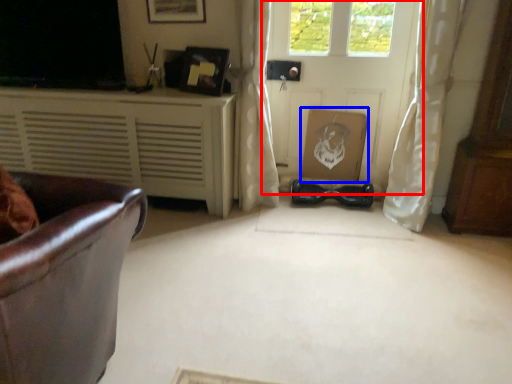
Question: Among these objects, which one is farthest to the camera, door (highlighted by a red box) or cardboard box (highlighted by a blue box)?

Choices:
 (A) door
 (B) cardboard box

Answer: (B)